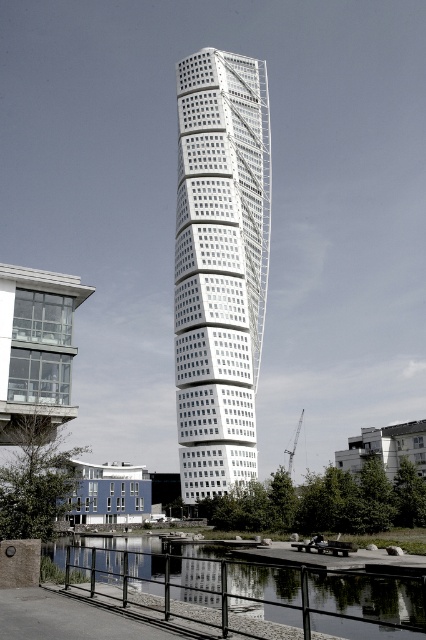
Between point (206, 490) and point (109, 474), which one is positioned behind?

The point (109, 474) is more distant.

Which is more to the right, white glass building at center or blue painted concrete building at lower left?

From the viewer's perspective, white glass building at center appears more on the right side.

Locate an element on the screen. The image size is (426, 640). white glass building at center is located at coordinates (219, 266).

This screenshot has height=640, width=426. Identify the location of white glass building at center. (219, 266).

Does white glass building at center lie behind white concrete building at lower right?

Yes.

Which is in front, point (244, 426) or point (356, 472)?

Point (356, 472)

I want to click on white glass building at center, so click(219, 266).

What do you see at coordinates (36, 348) in the screenshot? I see `clear glass building at left` at bounding box center [36, 348].

Does point (72, 307) come farther from viewer compared to point (89, 474)?

No, (72, 307) is closer to viewer.

Which is behind, point (5, 301) or point (134, 467)?

Positioned behind is point (134, 467).

Where is `clear glass building at left`? clear glass building at left is located at coordinates (36, 348).